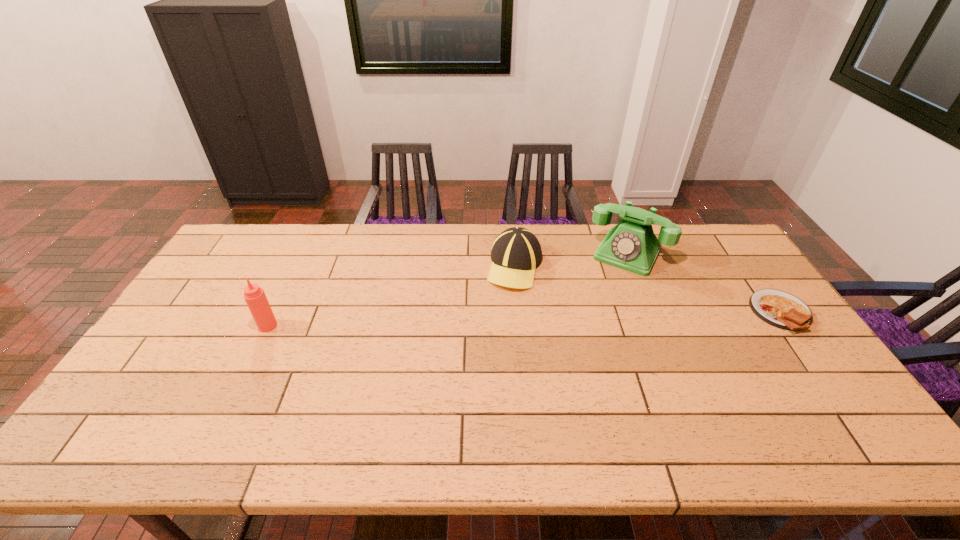
Where is `the leftmost object`? the leftmost object is located at coordinates (256, 300).

Identify the location of the rightmost object. 780,309.

Locate an element on the screen. omelet is located at coordinates (780, 309).

You are a GUI agent. You are given a task and a screenshot of the screen. Output one action in this format:
    pyautogui.click(x=<x>, y=<y>)
    Task: Click on the telephone
    
    Given the screenshot: What is the action you would take?
    pyautogui.click(x=631, y=245)

Image resolution: width=960 pixels, height=540 pixels. Identify the location of baseball cap. (516, 253).

The height and width of the screenshot is (540, 960). I want to click on the second shortest object, so click(x=516, y=253).

This screenshot has width=960, height=540. I want to click on vacant area situated 0.190m on the back of the leftmost object, so click(292, 277).

Where is `free spot located on the front of the rightmost object`? free spot located on the front of the rightmost object is located at coordinates (849, 407).

Image resolution: width=960 pixels, height=540 pixels. I want to click on vacant area situated on the dial of the telephone, so click(579, 341).

You are a GUI agent. You are given a task and a screenshot of the screen. Output one action in this format:
    pyautogui.click(x=<x>, y=<y>)
    Task: Click on the free location located 0.060m on the dial of the telephone
    Image resolution: width=960 pixels, height=540 pixels.
    Given the screenshot: What is the action you would take?
    pyautogui.click(x=611, y=284)